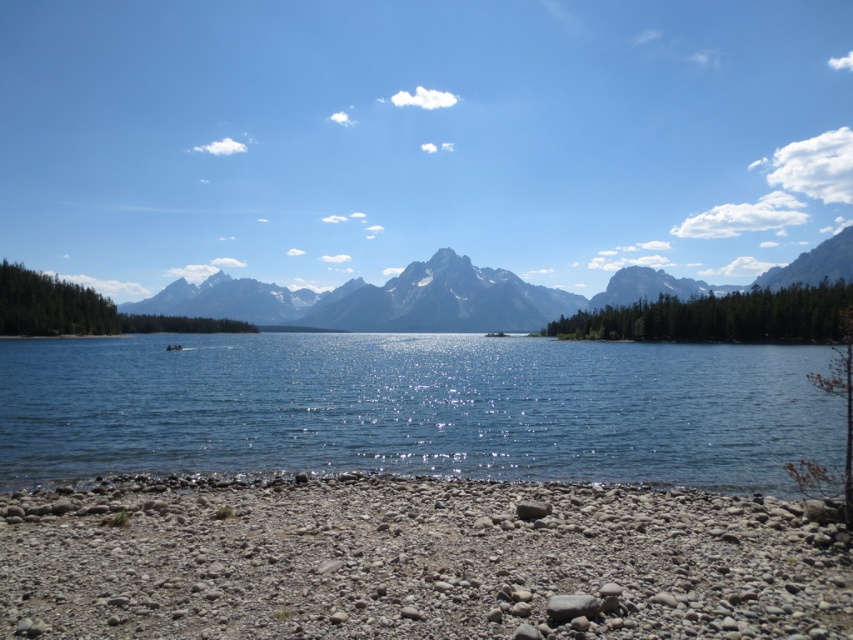
Question: Which point appears closest to the camera in this image?

Choices:
 (A) (175, 342)
 (B) (543, 500)
 (C) (460, 310)
 (D) (317, 401)

Answer: (B)

Question: Considering the relative positions of clear blue water at lower center and white plastic boat at center in the image provided, where is clear blue water at lower center located with respect to white plastic boat at center?

Choices:
 (A) below
 (B) above

Answer: (A)

Question: Among these objects, which one is farthest from the camera?

Choices:
 (A) gray smooth rock at lower center
 (B) white plastic boat at center
 (C) smooth gray rock at lower center
 (D) clear blue water at lower center

Answer: (B)

Question: Which point is closer to the camera?

Choices:
 (A) (403, 316)
 (B) (141, 406)
 (C) (181, 349)
 (D) (566, 602)

Answer: (D)

Question: Is clear blue water at lower center smaller than white plastic boat at center?

Choices:
 (A) no
 (B) yes

Answer: (A)

Question: Where is gray smooth rock at lower center located in relation to white plastic boat at center in the image?

Choices:
 (A) left
 (B) right

Answer: (B)